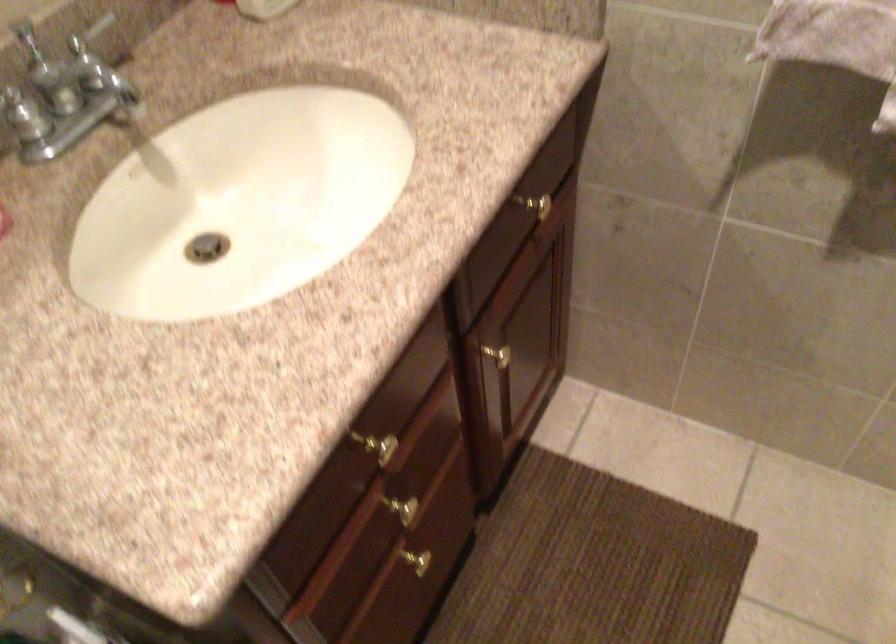
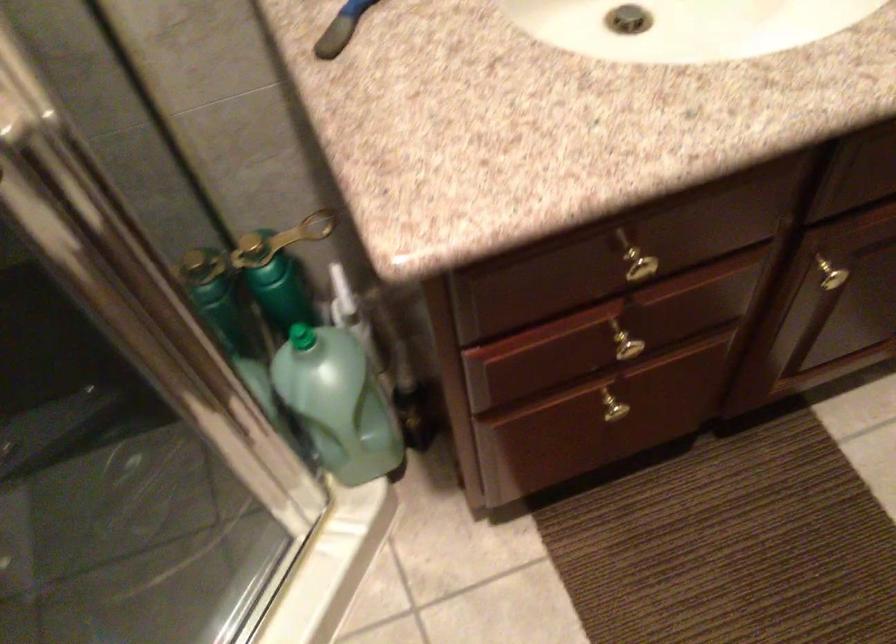
The point at (421, 565) is marked in the first image. Where is the corresponding point in the second image?

(616, 411)